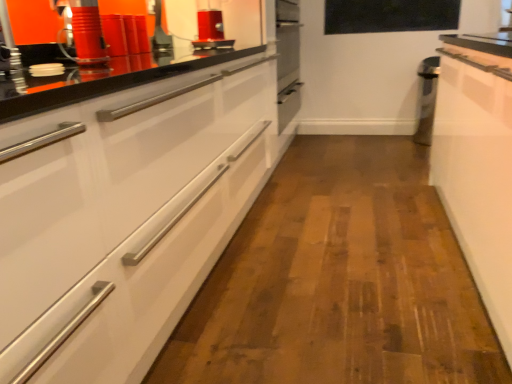
Question: Is black glass window screen at upper center behind matte red canister at upper left, which ranks as the 2th appliance in right-to-left order?

Choices:
 (A) no
 (B) yes

Answer: (B)

Question: Is black glass window screen at upper center smaller than matte red canister at upper left, which is the first appliance in front-to-back order?

Choices:
 (A) yes
 (B) no

Answer: (B)

Question: Is black glass window screen at upper center looking in the opposite direction of matte red canister at upper left, which ranks as the 2th appliance in right-to-left order?

Choices:
 (A) no
 (B) yes

Answer: (A)

Question: Considering the relative positions of black glass window screen at upper center and matte red canister at upper left, placed as the 2th appliance when sorted from top to bottom, in the image provided, is black glass window screen at upper center to the left of matte red canister at upper left, placed as the 2th appliance when sorted from top to bottom, from the viewer's perspective?

Choices:
 (A) no
 (B) yes

Answer: (A)

Question: Can you confirm if black glass window screen at upper center is taller than matte red canister at upper left, the first appliance from the bottom?

Choices:
 (A) yes
 (B) no

Answer: (A)

Question: Is white glossy cabinet at left wider or thinner than black glass window screen at upper center?

Choices:
 (A) wide
 (B) thin

Answer: (A)

Question: From the image's perspective, relative to black glass window screen at upper center, is white glossy cabinet at left above or below?

Choices:
 (A) above
 (B) below

Answer: (B)

Question: Choose the correct answer: Is white glossy cabinet at left inside black glass window screen at upper center or outside it?

Choices:
 (A) inside
 (B) outside

Answer: (B)

Question: Is white glossy cabinet at left in front of or behind black glass window screen at upper center in the image?

Choices:
 (A) front
 (B) behind

Answer: (A)

Question: In terms of size, does black glass window screen at upper center appear bigger or smaller than shiny red toaster at upper center, the 1th appliance viewed from the top?

Choices:
 (A) small
 (B) big

Answer: (B)

Question: Considering the positions of point (432, 29) and point (231, 41), is point (432, 29) closer or farther from the camera than point (231, 41)?

Choices:
 (A) farther
 (B) closer

Answer: (A)

Question: Considering the positions of black glass window screen at upper center and shiny red toaster at upper center, the second appliance when ordered from bottom to top, in the image, is black glass window screen at upper center wider or thinner than shiny red toaster at upper center, the second appliance when ordered from bottom to top,?

Choices:
 (A) thin
 (B) wide

Answer: (A)

Question: From the image's perspective, is black glass window screen at upper center located above or below shiny red toaster at upper center, the 1th appliance viewed from the top?

Choices:
 (A) above
 (B) below

Answer: (A)

Question: In terms of height, does shiny red toaster at upper center, placed as the first appliance when sorted from right to left, look taller or shorter compared to matte red canister at upper left, which is the first appliance in front-to-back order?

Choices:
 (A) short
 (B) tall

Answer: (B)

Question: Is shiny red toaster at upper center, marked as the second appliance in a left-to-right arrangement, inside the boundaries of matte red canister at upper left, the first appliance from the bottom, or outside?

Choices:
 (A) inside
 (B) outside

Answer: (B)